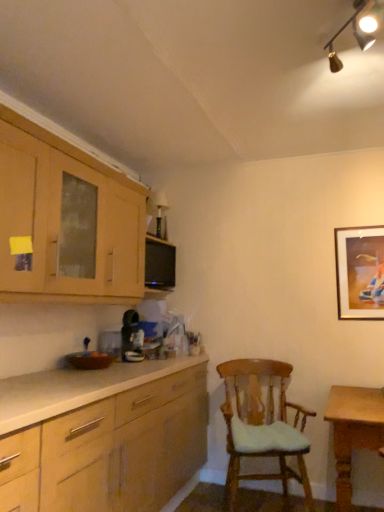
Question: Could you tell me if wooden cabinet at upper left is turned towards wooden table at lower right?

Choices:
 (A) yes
 (B) no

Answer: (B)

Question: From the image's perspective, is wooden cabinet at upper left over wooden table at lower right?

Choices:
 (A) no
 (B) yes

Answer: (B)

Question: Can you confirm if wooden cabinet at upper left is positioned to the left of wooden table at lower right?

Choices:
 (A) yes
 (B) no

Answer: (A)

Question: From the image's perspective, is wooden cabinet at upper left below wooden table at lower right?

Choices:
 (A) yes
 (B) no

Answer: (B)

Question: Is the depth of wooden cabinet at upper left less than that of wooden table at lower right?

Choices:
 (A) yes
 (B) no

Answer: (A)

Question: In the image, is gold-framed picture at upper right positioned in front of or behind wooden chair with cushion at center?

Choices:
 (A) front
 (B) behind

Answer: (B)

Question: Considering the positions of gold-framed picture at upper right and wooden chair with cushion at center in the image, is gold-framed picture at upper right wider or thinner than wooden chair with cushion at center?

Choices:
 (A) thin
 (B) wide

Answer: (A)

Question: Does point (337, 252) appear closer or farther from the camera than point (236, 470)?

Choices:
 (A) farther
 (B) closer

Answer: (A)

Question: In terms of size, does gold-framed picture at upper right appear bigger or smaller than wooden chair with cushion at center?

Choices:
 (A) big
 (B) small

Answer: (B)

Question: From the image's perspective, is gold metallic track lighting at upper right positioned above or below wooden chair with cushion at center?

Choices:
 (A) above
 (B) below

Answer: (A)

Question: Is gold metallic track lighting at upper right inside the boundaries of wooden chair with cushion at center, or outside?

Choices:
 (A) inside
 (B) outside

Answer: (B)

Question: In terms of size, does gold metallic track lighting at upper right appear bigger or smaller than wooden chair with cushion at center?

Choices:
 (A) small
 (B) big

Answer: (A)

Question: Based on their positions, is gold metallic track lighting at upper right located to the left or right of wooden chair with cushion at center?

Choices:
 (A) left
 (B) right

Answer: (B)

Question: In terms of height, does gold-framed picture at upper right look taller or shorter compared to wooden table at lower right?

Choices:
 (A) short
 (B) tall

Answer: (A)

Question: Do you think gold-framed picture at upper right is within wooden table at lower right, or outside of it?

Choices:
 (A) outside
 (B) inside

Answer: (A)